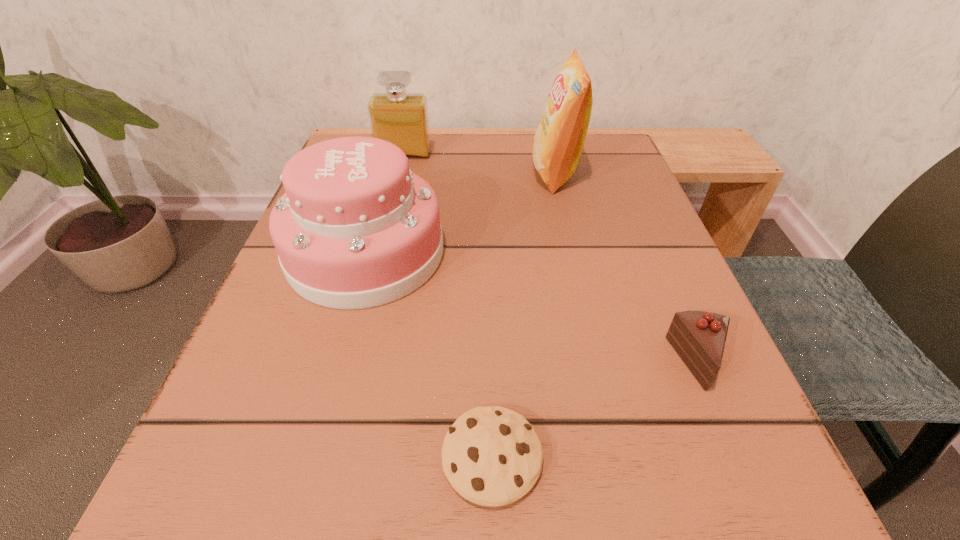
Where is `vacant space in between the tallest object and the nearest object`? This screenshot has height=540, width=960. vacant space in between the tallest object and the nearest object is located at coordinates (523, 315).

Find the location of a particular element. This screenshot has width=960, height=540. vacant area between the fourth farthest object and the cookie is located at coordinates click(596, 410).

Find the location of a particular element. free space between the third object from right to left and the perfume is located at coordinates (448, 306).

At what (x,y) coordinates should I click in order to perform the action: click on vacant area that lies between the chocolate cake and the nearest object. Please return your answer as a coordinate pair (x, y). Looking at the image, I should click on (596, 410).

The width and height of the screenshot is (960, 540). What are the coordinates of `unoccupied position between the cookie and the third nearest object` in the screenshot? It's located at (429, 355).

Locate an element on the screen. This screenshot has height=540, width=960. blank region between the nearest object and the cake is located at coordinates [x=429, y=355].

Identify the location of free point between the tallest object and the third farthest object. (461, 213).

The width and height of the screenshot is (960, 540). Find the location of `free space that is in between the third farthest object and the fourth tallest object`. free space that is in between the third farthest object and the fourth tallest object is located at coordinates (533, 307).

Where is `empty location between the perfume and the tallest object`? The image size is (960, 540). empty location between the perfume and the tallest object is located at coordinates (480, 164).

At what (x,y) coordinates should I click in order to perform the action: click on object that stands as the second closest to the third nearest object. Please return your answer as a coordinate pair (x, y). Looking at the image, I should click on (558, 143).